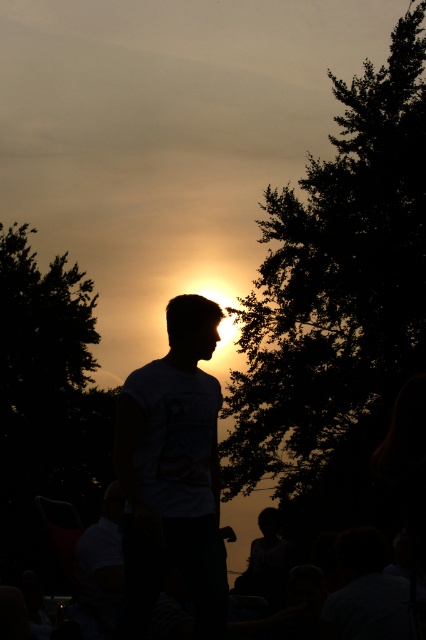
You are standing at the point marked by the coordinates point (x=337, y=305) in the image. What object is located at this point?

The dark green leafy tree at right is located at point (x=337, y=305).